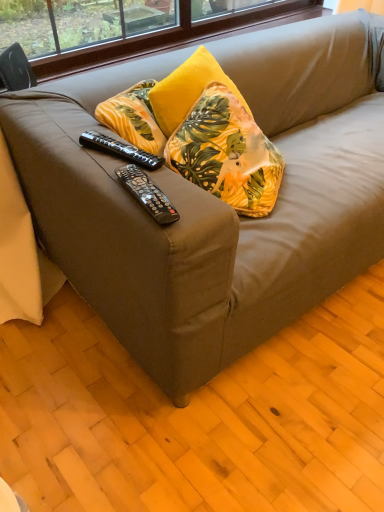
Where is `blank area to the left of black plastic remote control at center, which is the 2th remote control from top to bottom`? blank area to the left of black plastic remote control at center, which is the 2th remote control from top to bottom is located at coordinates (106, 183).